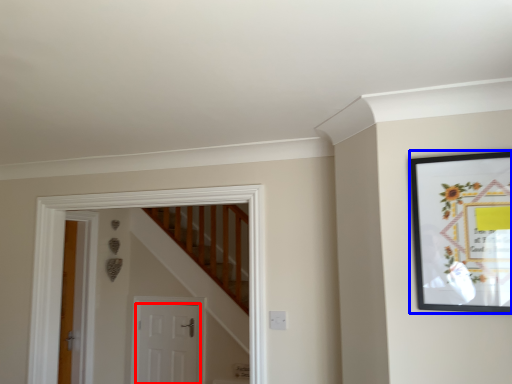
Question: Which object is further to the camera taking this photo, door (highlighted by a red box) or picture frame (highlighted by a blue box)?

Choices:
 (A) door
 (B) picture frame

Answer: (A)